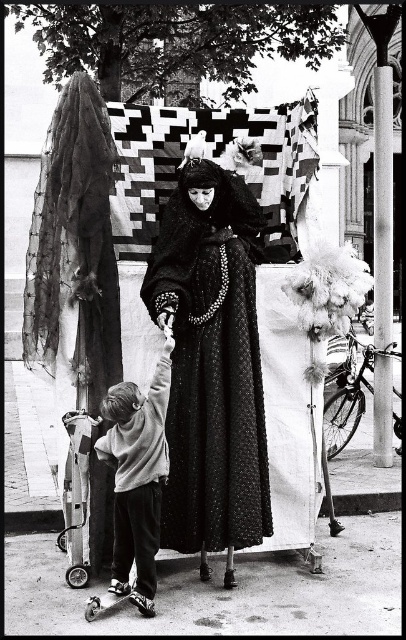
Question: Is black textured dress at center wider than light gray sweater at lower left?

Choices:
 (A) no
 (B) yes

Answer: (B)

Question: Can you confirm if black textured dress at center is bigger than light gray sweater at lower left?

Choices:
 (A) no
 (B) yes

Answer: (B)

Question: Does black textured dress at center have a smaller size compared to light gray sweater at lower left?

Choices:
 (A) no
 (B) yes

Answer: (A)